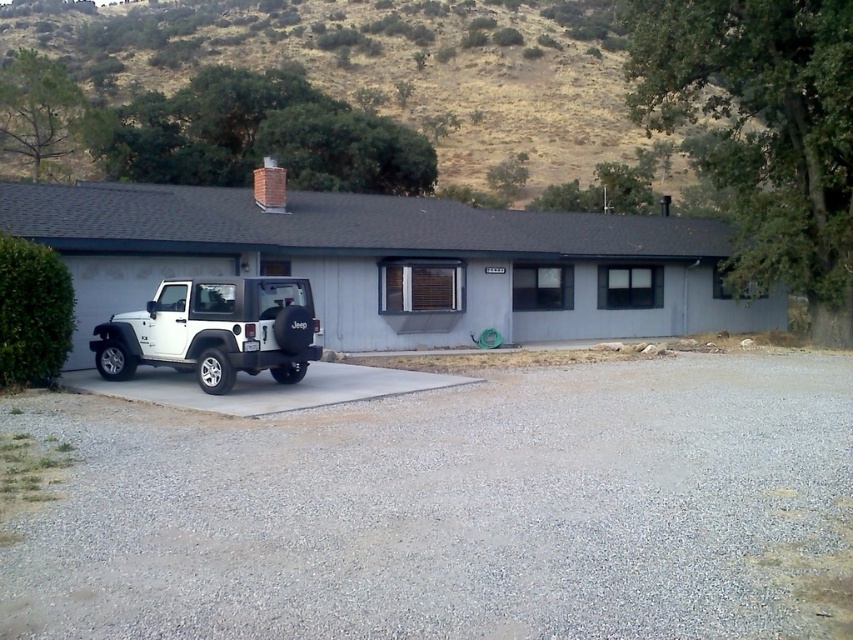
Between point (132, 284) and point (474, 81), which one is positioned in front?

Positioned in front is point (132, 284).

Who is more distant from viewer, (692, 252) or (465, 72)?

Positioned behind is point (465, 72).

Describe the element at coordinates (393, 262) in the screenshot. I see `white matte pickup truck at left` at that location.

Identify the location of white matte pickup truck at left. (393, 262).

Between gray gravel at lower left and white matte pickup truck at left, which one appears on the right side from the viewer's perspective?

gray gravel at lower left

Can you confirm if gray gravel at lower left is smaller than white matte pickup truck at left?

Indeed, gray gravel at lower left has a smaller size compared to white matte pickup truck at left.

Between point (759, 548) and point (157, 205), which one is positioned behind?

The point (157, 205) is behind.

Locate an element on the screen. The image size is (853, 640). gray gravel at lower left is located at coordinates (450, 509).

Can you confirm if dried grass at upper center is wider than white matte jeep at lower left?

Correct, the width of dried grass at upper center exceeds that of white matte jeep at lower left.

Who is taller, dried grass at upper center or white matte jeep at lower left?

Standing taller between the two is dried grass at upper center.

This screenshot has width=853, height=640. Describe the element at coordinates (381, 67) in the screenshot. I see `dried grass at upper center` at that location.

This screenshot has height=640, width=853. Identify the location of dried grass at upper center. (381, 67).